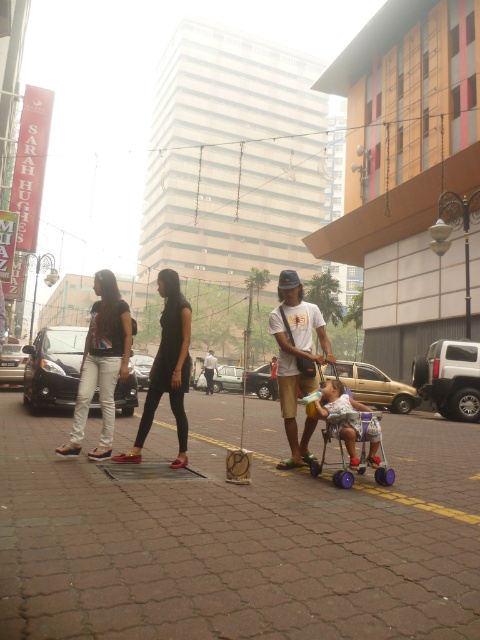
Question: Estimate the real-world distances between objects in this image. Which object is closer to the matte black shirt at center?

Choices:
 (A) black matte dress at center
 (B) purple plastic baby carriage at center
 (C) matte white t-shirt at center
 (D) light brown leather jacket at center

Answer: (A)

Question: Based on their relative distances, which object is farther from the purple plastic baby carriage at center?

Choices:
 (A) matte black shirt at center
 (B) light brown leather jacket at center

Answer: (B)

Question: Is brown brick pavement at center bigger than purple plastic baby carriage at center?

Choices:
 (A) no
 (B) yes

Answer: (B)

Question: Does matte white t-shirt at center appear on the right side of light brown leather jacket at center?

Choices:
 (A) no
 (B) yes

Answer: (B)

Question: Considering the relative positions of matte white t-shirt at center and light brown leather jacket at center in the image provided, where is matte white t-shirt at center located with respect to light brown leather jacket at center?

Choices:
 (A) below
 (B) above

Answer: (B)

Question: Which point is farther to the camera?

Choices:
 (A) purple plastic baby carriage at center
 (B) matte black shirt at center
 (C) matte white t-shirt at center

Answer: (B)